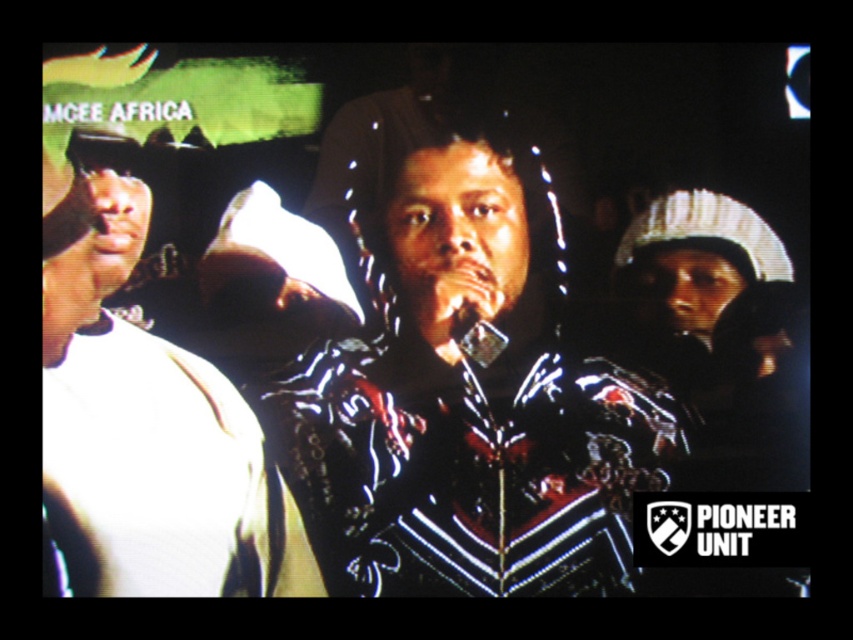
Question: Does shiny black jacket at center appear on the left side of white matte shirt at left?

Choices:
 (A) yes
 (B) no

Answer: (B)

Question: Can you confirm if shiny black jacket at center is thinner than metallic silver microphone at center?

Choices:
 (A) no
 (B) yes

Answer: (A)

Question: Which of the following is the farthest from the observer?

Choices:
 (A) white matte shirt at left
 (B) shiny black jacket at center

Answer: (B)

Question: Among these objects, which one is farthest from the camera?

Choices:
 (A) white matte shirt at left
 (B) shiny black jacket at center

Answer: (B)

Question: Is shiny black jacket at center positioned in front of white matte shirt at left?

Choices:
 (A) yes
 (B) no

Answer: (B)

Question: Which point is closer to the camera?

Choices:
 (A) metallic silver microphone at center
 (B) white matte shirt at left

Answer: (B)